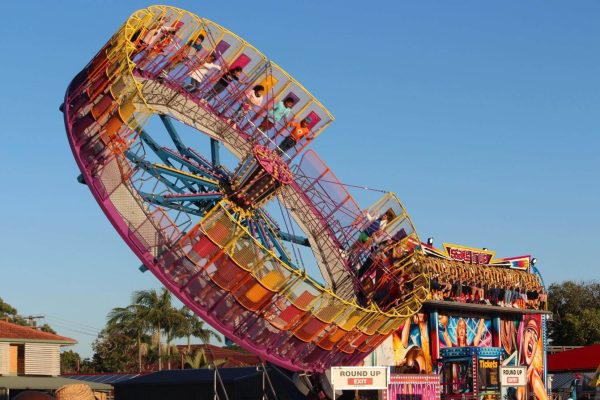
Find the location of a particular element. far right painting is located at coordinates (532, 344).